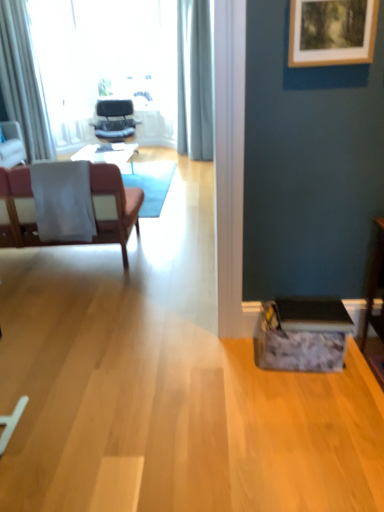
Question: From the image's perspective, is light gray fabric curtain at upper center, the 1th curtain positioned from the right, beneath matte black chair at center, arranged as the second chair when viewed from the right?

Choices:
 (A) yes
 (B) no

Answer: (B)

Question: From the image's perspective, is light gray fabric curtain at upper center, acting as the second curtain starting from the left, located above matte black chair at center, which appears as the 1th chair when viewed from the top?

Choices:
 (A) no
 (B) yes

Answer: (B)

Question: From a real-world perspective, does light gray fabric curtain at upper center, acting as the second curtain starting from the left, sit lower than matte black chair at center, which is the 2th chair from left to right?

Choices:
 (A) yes
 (B) no

Answer: (B)

Question: Is light gray fabric curtain at upper center, acting as the second curtain starting from the left, at the right side of matte black chair at center, acting as the third chair starting from the front?

Choices:
 (A) yes
 (B) no

Answer: (A)

Question: Can you confirm if light gray fabric curtain at upper center, the 1th curtain positioned from the right, is bigger than matte black chair at center, arranged as the second chair when viewed from the right?

Choices:
 (A) yes
 (B) no

Answer: (A)

Question: Does point (11, 152) appear closer or farther from the camera than point (97, 198)?

Choices:
 (A) farther
 (B) closer

Answer: (A)

Question: Considering the positions of matte pink chair at left, placed as the second chair when sorted from top to bottom, and pink fabric chair at left, the 3th chair when ordered from back to front, in the image, is matte pink chair at left, placed as the second chair when sorted from top to bottom, bigger or smaller than pink fabric chair at left, the 3th chair when ordered from back to front,?

Choices:
 (A) big
 (B) small

Answer: (B)

Question: Looking at their shapes, would you say matte pink chair at left, positioned as the second chair in front-to-back order, is wider or thinner than pink fabric chair at left, the first chair from the right?

Choices:
 (A) thin
 (B) wide

Answer: (A)

Question: Is matte pink chair at left, arranged as the 2th chair when ordered from the bottom, in front of or behind pink fabric chair at left, the third chair from the left, in the image?

Choices:
 (A) behind
 (B) front

Answer: (A)

Question: In the image, is pink fabric chair at left, which appears as the first chair when ordered from the bottom, on the left side or the right side of wooden picture frame at upper right?

Choices:
 (A) left
 (B) right

Answer: (A)

Question: Looking at their shapes, would you say pink fabric chair at left, the first chair from the right, is wider or thinner than wooden picture frame at upper right?

Choices:
 (A) thin
 (B) wide

Answer: (B)

Question: In terms of height, does pink fabric chair at left, the third chair from the left, look taller or shorter compared to wooden picture frame at upper right?

Choices:
 (A) short
 (B) tall

Answer: (B)

Question: From the image's perspective, is pink fabric chair at left, the 3th chair when ordered from back to front, positioned above or below wooden picture frame at upper right?

Choices:
 (A) above
 (B) below

Answer: (B)

Question: Considering the relative positions of matte black chair at center, arranged as the second chair when viewed from the right, and pink fabric chair at left, which appears as the first chair when ordered from the bottom, in the image provided, is matte black chair at center, arranged as the second chair when viewed from the right, to the left or to the right of pink fabric chair at left, which appears as the first chair when ordered from the bottom,?

Choices:
 (A) left
 (B) right

Answer: (A)

Question: In terms of height, does matte black chair at center, the 1th chair when ordered from back to front, look taller or shorter compared to pink fabric chair at left, which appears as the first chair when ordered from the bottom?

Choices:
 (A) short
 (B) tall

Answer: (A)